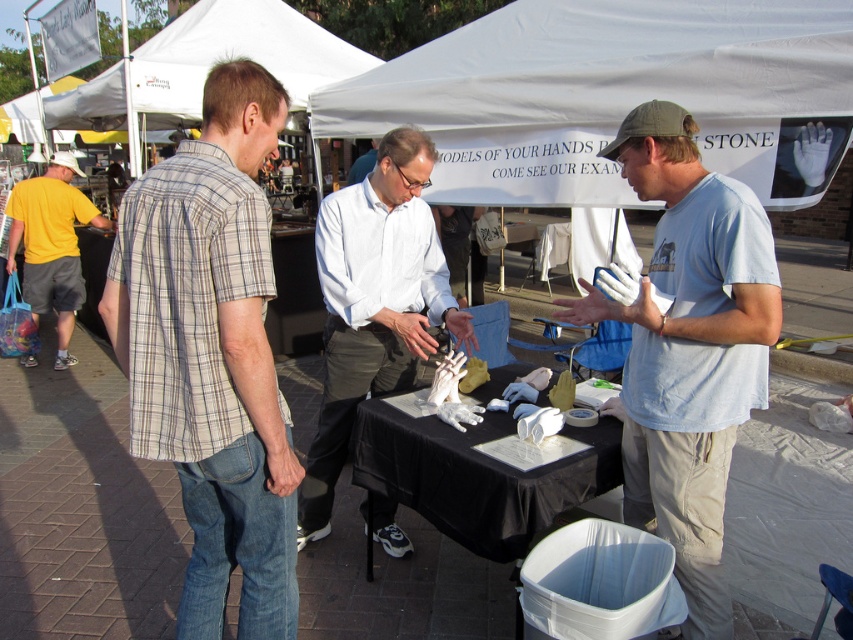
Does plaid shirt at center come behind white matte hand at center?

No, it is in front of white matte hand at center.

Who is more distant from viewer, (x=258, y=516) or (x=379, y=188)?

Positioned behind is point (x=379, y=188).

You are a GUI agent. You are given a task and a screenshot of the screen. Output one action in this format:
    pyautogui.click(x=<x>, y=<y>)
    Task: Click on the plaid shirt at center
    
    Given the screenshot: What is the action you would take?
    pyautogui.click(x=212, y=353)

How distant is plaid shirt at center from light blue t-shirt at center?

The distance of plaid shirt at center from light blue t-shirt at center is 3.97 feet.

Between plaid shirt at center and light blue t-shirt at center, which one has less height?

Standing shorter between the two is plaid shirt at center.

This screenshot has height=640, width=853. In order to click on plaid shirt at center in this screenshot , I will do `click(212, 353)`.

This screenshot has width=853, height=640. I want to click on plaid shirt at center, so click(212, 353).

Who is shorter, plaid shirt at center or black matte table at center?

Standing shorter between the two is black matte table at center.

Measure the distance between point (178, 624) and camera.

Point (178, 624) is 2.13 meters away from camera.

Is point (276, 116) farther from camera compared to point (459, 520)?

No, it is in front of (459, 520).

The width and height of the screenshot is (853, 640). Identify the location of plaid shirt at center. (212, 353).